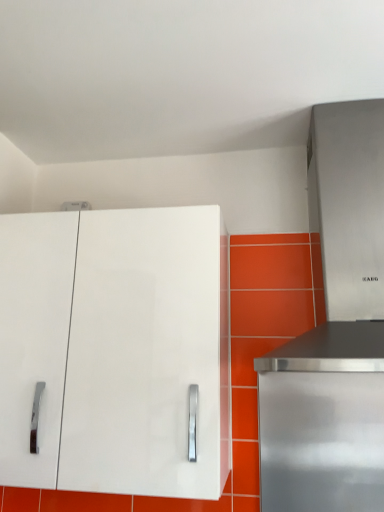
Question: Would you say stainless steel range hood at upper right is part of stainless steel range hood at right's contents?

Choices:
 (A) no
 (B) yes

Answer: (A)

Question: Is stainless steel range hood at right bigger than stainless steel range hood at upper right?

Choices:
 (A) yes
 (B) no

Answer: (B)

Question: Does stainless steel range hood at right have a lesser height compared to stainless steel range hood at upper right?

Choices:
 (A) no
 (B) yes

Answer: (B)

Question: Does stainless steel range hood at right appear on the left side of stainless steel range hood at upper right?

Choices:
 (A) yes
 (B) no

Answer: (B)

Question: From the image's perspective, is stainless steel range hood at right on stainless steel range hood at upper right?

Choices:
 (A) yes
 (B) no

Answer: (B)

Question: Is white glossy cabinet at upper left to the left or to the right of stainless steel range hood at upper right in the image?

Choices:
 (A) right
 (B) left

Answer: (B)

Question: From the image's perspective, is white glossy cabinet at upper left positioned above or below stainless steel range hood at upper right?

Choices:
 (A) below
 (B) above

Answer: (A)

Question: From their relative heights in the image, would you say white glossy cabinet at upper left is taller or shorter than stainless steel range hood at upper right?

Choices:
 (A) short
 (B) tall

Answer: (A)

Question: Is white glossy cabinet at upper left situated inside stainless steel range hood at upper right or outside?

Choices:
 (A) inside
 (B) outside

Answer: (B)

Question: Considering the relative positions of white glossy cabinet at upper left and stainless steel range hood at right in the image provided, is white glossy cabinet at upper left to the left or to the right of stainless steel range hood at right?

Choices:
 (A) right
 (B) left

Answer: (B)

Question: Considering the positions of white glossy cabinet at upper left and stainless steel range hood at right in the image, is white glossy cabinet at upper left bigger or smaller than stainless steel range hood at right?

Choices:
 (A) small
 (B) big

Answer: (B)

Question: In terms of width, does white glossy cabinet at upper left look wider or thinner when compared to stainless steel range hood at right?

Choices:
 (A) thin
 (B) wide

Answer: (B)

Question: Is white glossy cabinet at upper left inside or outside of stainless steel range hood at right?

Choices:
 (A) inside
 (B) outside

Answer: (B)

Question: Is stainless steel range hood at upper right to the left or to the right of white glossy cabinet at upper left in the image?

Choices:
 (A) left
 (B) right

Answer: (B)

Question: Is point (349, 418) closer or farther from the camera than point (192, 310)?

Choices:
 (A) closer
 (B) farther

Answer: (B)